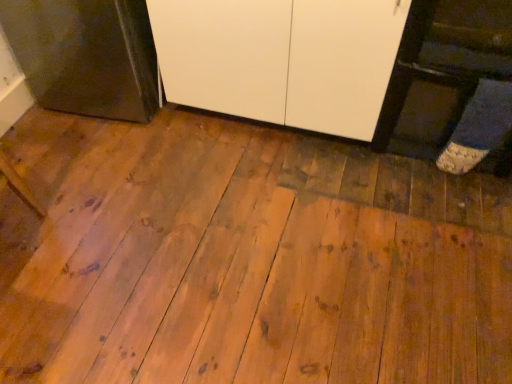
I want to click on vacant area that lies in front of white matte cabinet at center, so click(x=276, y=206).